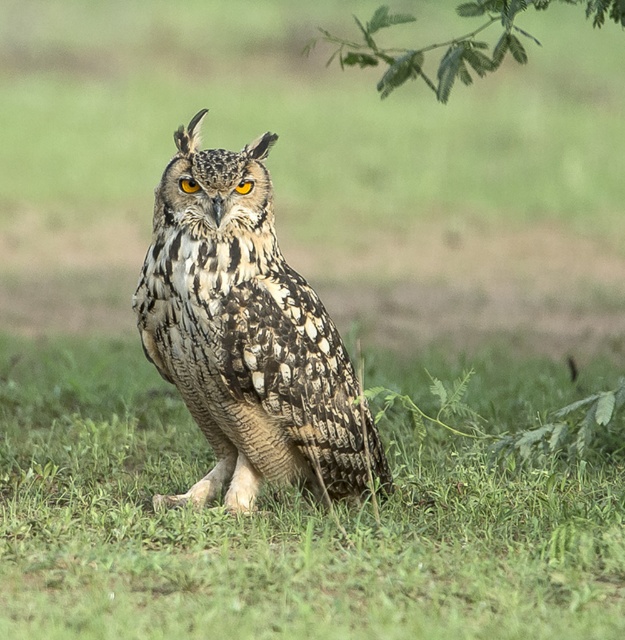
You are a photographer who wants to capture the camouflage feathered owl at center and the green leafy branch at upper center in a single shot. Can you tell me which one is closer to the camera?

The camouflage feathered owl at center is closer to the camera than the green leafy branch at upper center because the branch is positioned behind the owl.

You are a photographer trying to capture a closeup of the speckled feather owl at center. You are currently standing 5 meters away from the owl. How much closer do you need to move to achieve the ideal 3 meter distance for a sharp closeup?

The speckled feather owl at center is currently 3.15 meters away from the camera. To achieve the ideal 3 meter distance, you need to move 0.15 meters closer.

You are a photographer trying to capture the owl in the image. You notice the camouflage feathered owl at center and the green leafy branch at upper center. Which object is narrower in width?

The camouflage feathered owl at center has a lesser width compared to the green leafy branch at upper center, so the camouflage feathered owl at center is narrower in width.